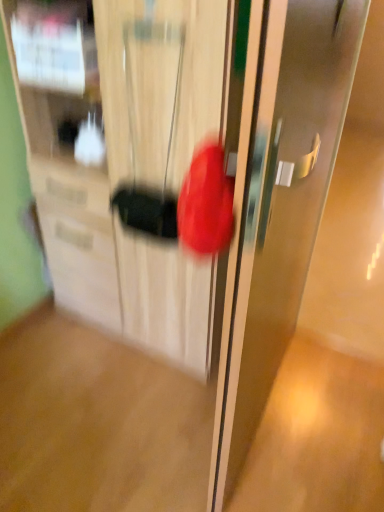
Question: Considering the positions of point (289, 342) and point (175, 32), is point (289, 342) closer or farther from the camera than point (175, 32)?

Choices:
 (A) farther
 (B) closer

Answer: (A)

Question: Looking at the image, does satin silver door at center seem bigger or smaller compared to matte wooden cabinet at center?

Choices:
 (A) small
 (B) big

Answer: (A)

Question: Visually, is satin silver door at center positioned to the left or to the right of matte wooden cabinet at center?

Choices:
 (A) left
 (B) right

Answer: (B)

Question: In the image, is matte wooden cabinet at center on the left side or the right side of satin silver door at center?

Choices:
 (A) right
 (B) left

Answer: (B)

Question: Is matte wooden cabinet at center taller or shorter than satin silver door at center?

Choices:
 (A) tall
 (B) short

Answer: (B)

Question: From a real-world perspective, is matte wooden cabinet at center positioned above or below satin silver door at center?

Choices:
 (A) above
 (B) below

Answer: (B)

Question: Is point (139, 203) closer or farther from the camera than point (241, 460)?

Choices:
 (A) farther
 (B) closer

Answer: (B)